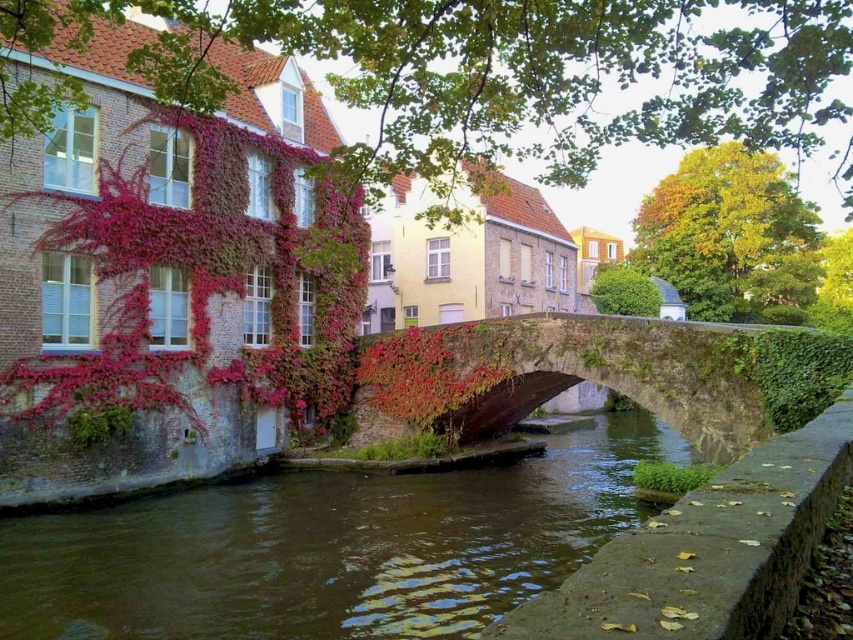
Which is more to the right, brown stone river at center or stone bridge at center?

stone bridge at center

This screenshot has height=640, width=853. Identify the location of brown stone river at center. pyautogui.click(x=329, y=548).

Is point (503, 564) positioned behind point (693, 362)?

No, it is not.

The height and width of the screenshot is (640, 853). In order to click on brown stone river at center in this screenshot , I will do `click(329, 548)`.